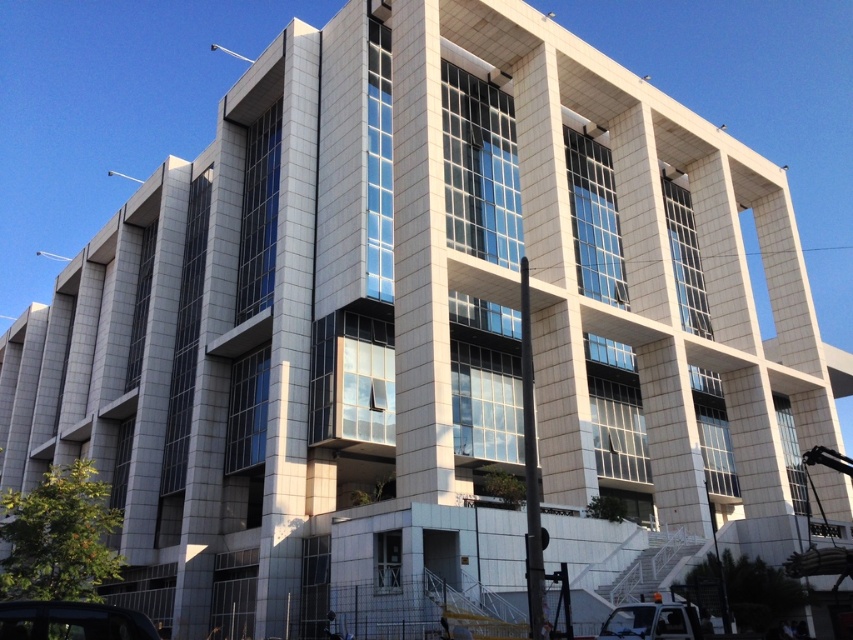
Who is lower down, shiny black car at lower left or metallic silver car at lower right?

Positioned lower is metallic silver car at lower right.

Describe the element at coordinates (71, 621) in the screenshot. The image size is (853, 640). I see `shiny black car at lower left` at that location.

The image size is (853, 640). What do you see at coordinates (71, 621) in the screenshot?
I see `shiny black car at lower left` at bounding box center [71, 621].

You are a GUI agent. You are given a task and a screenshot of the screen. Output one action in this format:
    pyautogui.click(x=<x>, y=<y>)
    Task: Click on the shiny black car at lower left
    The width and height of the screenshot is (853, 640).
    Given the screenshot: What is the action you would take?
    pyautogui.click(x=71, y=621)